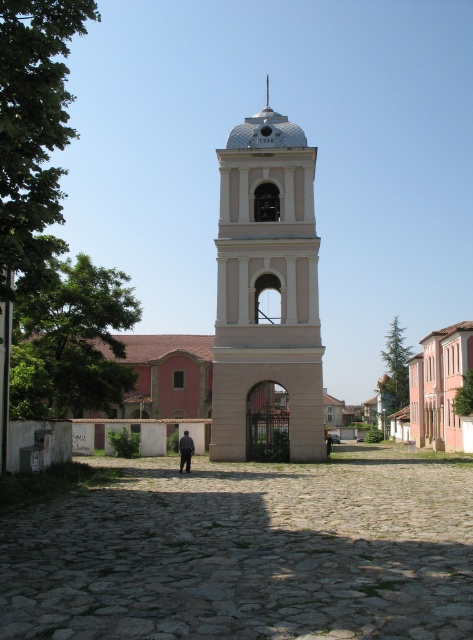
Question: Can you confirm if white smooth bell tower at center is thinner than black fabric person at center?

Choices:
 (A) yes
 (B) no

Answer: (B)

Question: Does white smooth bell tower at center have a larger size compared to dark gray fabric at center?

Choices:
 (A) no
 (B) yes

Answer: (B)

Question: Which object is closer to the camera taking this photo?

Choices:
 (A) dark gray fabric at center
 (B) white smooth bell tower at center
 (C) black fabric person at center

Answer: (C)

Question: Which point is farther to the camera?

Choices:
 (A) dark gray fabric at center
 (B) black fabric person at center
 (C) white smooth bell tower at center

Answer: (A)

Question: Does white smooth bell tower at center have a smaller size compared to black fabric person at center?

Choices:
 (A) yes
 (B) no

Answer: (B)

Question: Estimate the real-world distances between objects in this image. Which object is farther from the dark gray fabric at center?

Choices:
 (A) white smooth bell tower at center
 (B) black fabric person at center

Answer: (A)